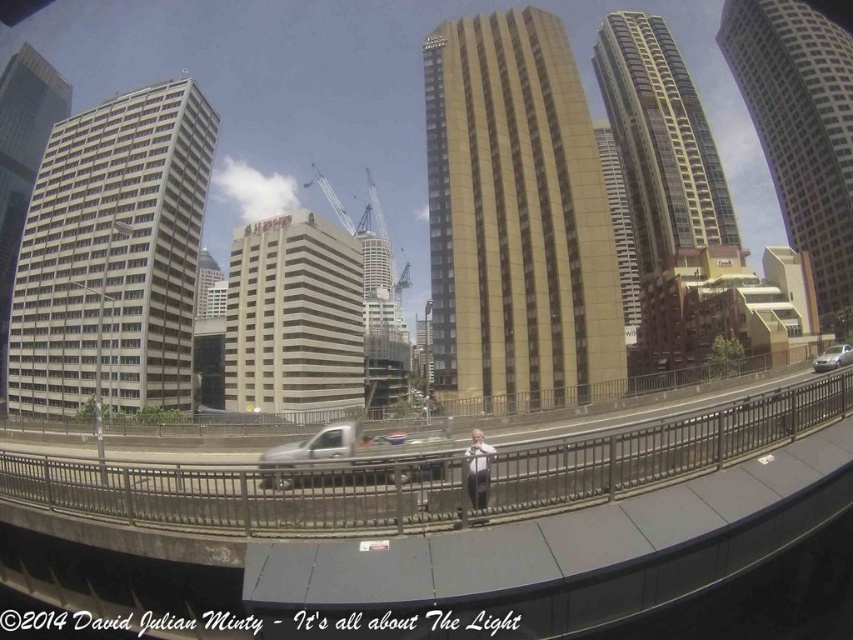
Measure the distance between concrete at center and camera.

concrete at center is 60.88 meters from camera.

Between concrete at center and light gray suit at center, which one is positioned higher?

Positioned higher is concrete at center.

This screenshot has height=640, width=853. Find the location of `concrete at center`. concrete at center is located at coordinates (460, 531).

Does point (305, 452) come in front of point (837, 365)?

Yes, it is.

Does silver metallic truck at center appear over silver metallic sedan at right?

No.

Does point (355, 424) lie behind point (848, 356)?

No, it is in front of (848, 356).

Identify the location of silver metallic truck at center. (334, 458).

Between silver metallic truck at center and light gray suit at center, which one appears on the left side from the viewer's perspective?

silver metallic truck at center

Between silver metallic truck at center and light gray suit at center, which one appears on the right side from the viewer's perspective?

light gray suit at center is more to the right.

Locate an element on the screen. silver metallic truck at center is located at coordinates (334, 458).